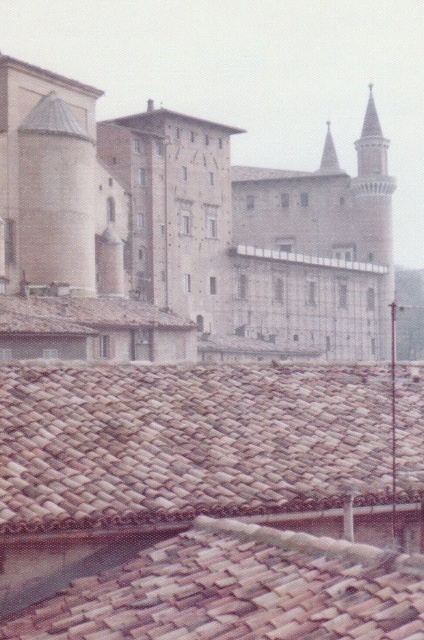
You are standing in front of the historical building complex. There is a point marked at coordinates (239, 589). What object does this point correspond to?

The point corresponds to the brown clay tiles at center.

You are standing 60 feet away from the main castle entrance. You want to place a decorative flagpole that is 1 foot tall on the brown clay tiles at lower center. Will the flagpole be visible from your current position?

The brown clay tiles at lower center are 59.90 feet away from the viewer. Since the flagpole is only 1 foot tall, it may not be easily visible from 60 feet away due to distance and potential obstruction from the surrounding rooftops and structures.

You are standing at the point marked as point (186, 440) in the image. What surface are you standing on?

You are standing on brown clay tiles at lower center.